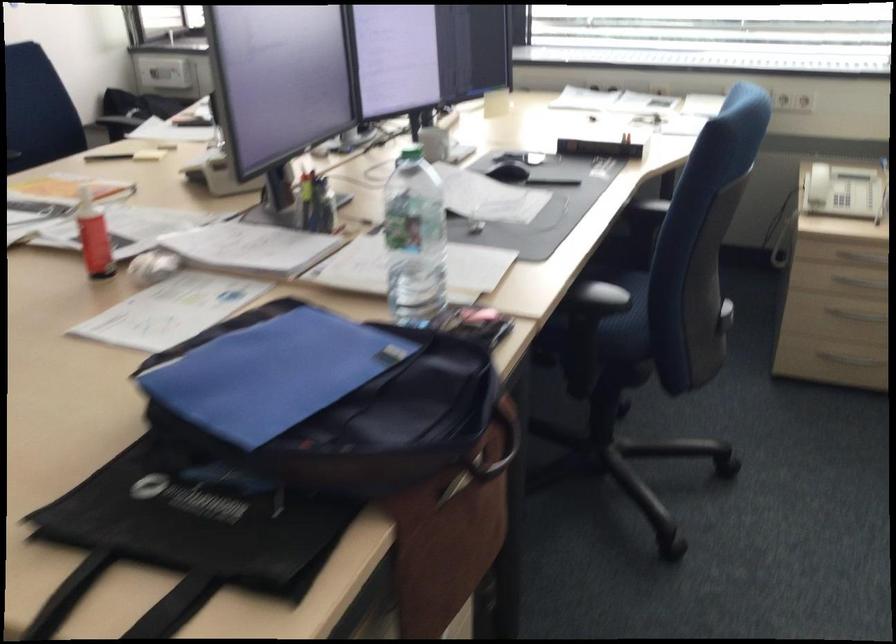
The image size is (896, 644). I want to click on chair armrest, so click(645, 209).